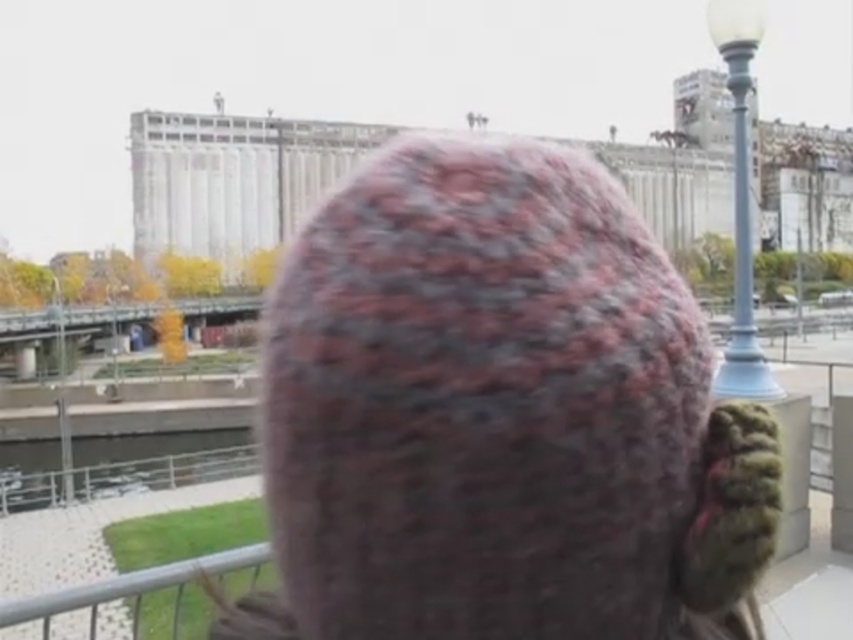
Question: Among these objects, which one is farthest from the camera?

Choices:
 (A) clear water at lower left
 (B) metallic silver rail at lower left

Answer: (A)

Question: Can you confirm if knitted woolen hat at center is positioned to the right of clear water at lower left?

Choices:
 (A) no
 (B) yes

Answer: (B)

Question: Which object is closer to the camera taking this photo?

Choices:
 (A) light blue glass lamp post at upper right
 (B) clear water at lower left
 (C) metallic silver rail at lower left

Answer: (A)

Question: Which object is the closest to the clear water at lower left?

Choices:
 (A) light blue glass lamp post at upper right
 (B) knitted woolen hat at center

Answer: (B)

Question: Does knitted woolen hat at center appear on the left side of clear water at lower left?

Choices:
 (A) no
 (B) yes

Answer: (A)

Question: Does knitted woolen hat at center have a lesser width compared to light blue glass lamp post at upper right?

Choices:
 (A) yes
 (B) no

Answer: (A)